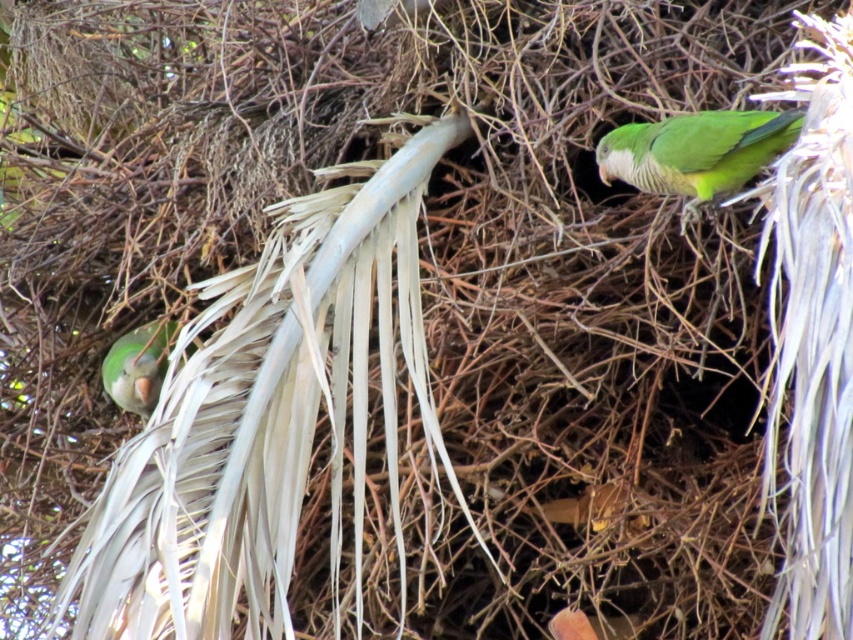
Question: Which point is farther from the camera taking this photo?

Choices:
 (A) (120, 346)
 (B) (685, 209)

Answer: (A)

Question: Which of the following is the closest to the observer?

Choices:
 (A) green matte parrot at upper right
 (B) matte green parrot at left

Answer: (A)

Question: Does green matte parrot at upper right appear on the left side of matte green parrot at left?

Choices:
 (A) no
 (B) yes

Answer: (A)

Question: Which object appears farthest from the camera in this image?

Choices:
 (A) green matte parrot at upper right
 (B) matte green parrot at left

Answer: (B)

Question: Can you confirm if green matte parrot at upper right is positioned to the right of matte green parrot at left?

Choices:
 (A) yes
 (B) no

Answer: (A)

Question: Is green matte parrot at upper right to the left of matte green parrot at left from the viewer's perspective?

Choices:
 (A) yes
 (B) no

Answer: (B)